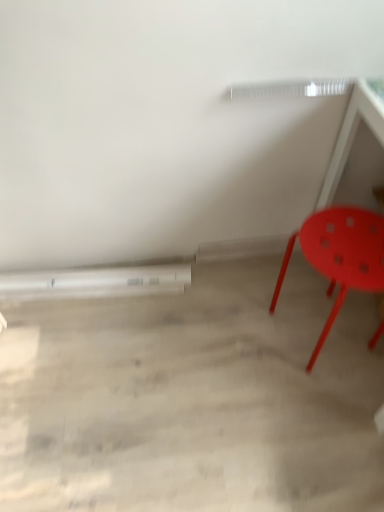
You are a GUI agent. You are given a task and a screenshot of the screen. Output one action in this format:
    pyautogui.click(x=<x>, y=<y>)
    Task: Click on the vacant space underneath matte plastic chair at right (from a real-world perspective)
    Image resolution: width=384 pixels, height=512 pixels.
    Given the screenshot: What is the action you would take?
    [x=306, y=330]